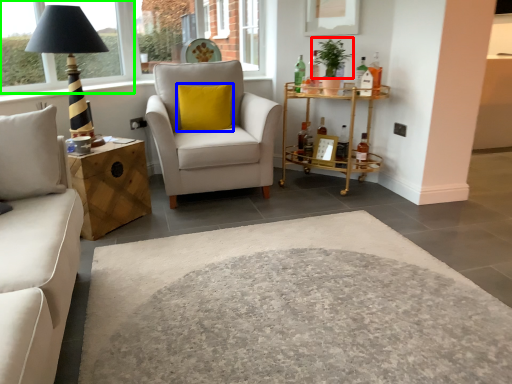
Question: Considering the real-world distances, which object is farthest from plant (highlighted by a red box)? pillow (highlighted by a blue box) or window frame (highlighted by a green box)?

Choices:
 (A) pillow
 (B) window frame

Answer: (B)